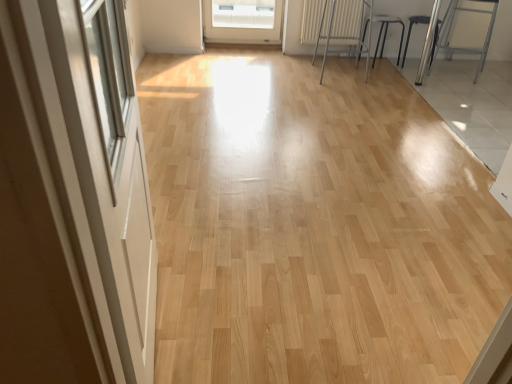
Question: Is white textured radiator at upper center taller or shorter than white glossy screen door at left?

Choices:
 (A) short
 (B) tall

Answer: (A)

Question: In terms of width, does white textured radiator at upper center look wider or thinner when compared to white glossy screen door at left?

Choices:
 (A) wide
 (B) thin

Answer: (B)

Question: Estimate the real-world distances between objects in this image. Which object is farther from the metallic silver radiator at upper center?

Choices:
 (A) metallic silver stool at upper right, which is the 3th armchair from right to left
 (B) black metal stool at upper right, the second armchair viewed from the right
 (C) metallic silver armchair at right, the third armchair positioned from the left
 (D) white textured radiator at upper center
 (E) white glossy screen door at left

Answer: (E)

Question: Considering the real-world distances, which object is closest to the white textured radiator at upper center?

Choices:
 (A) metallic silver radiator at upper center
 (B) metallic silver armchair at right, the third armchair positioned from the left
 (C) metallic silver stool at upper right, which is the first armchair from left to right
 (D) white glossy screen door at left
 (E) black metal stool at upper right, the 2th armchair viewed from the left

Answer: (A)